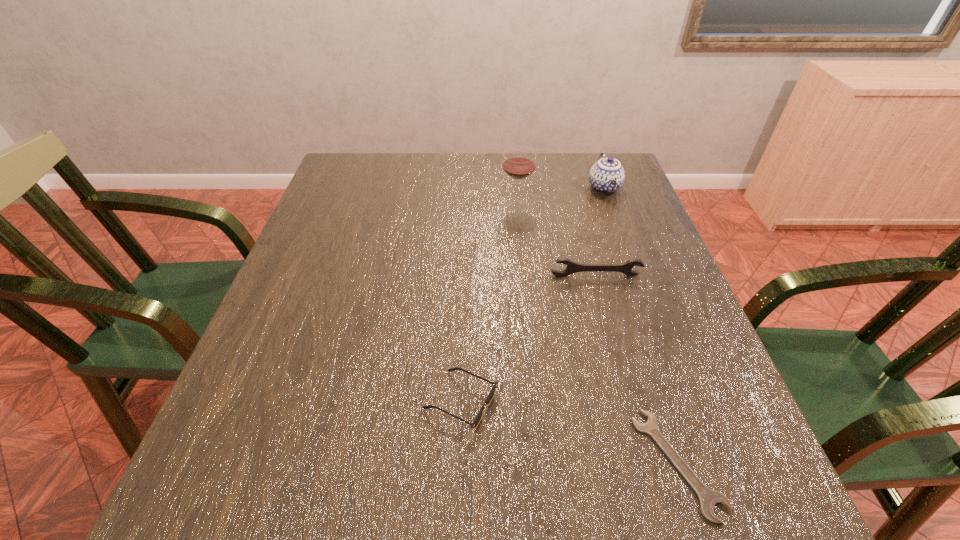
I want to click on vacant area that lies between the second shortest object and the second object from left to right, so click(x=489, y=303).

The height and width of the screenshot is (540, 960). Find the location of `free space between the leftmost object and the chinaware`. free space between the leftmost object and the chinaware is located at coordinates (533, 294).

Locate an element on the screen. Image resolution: width=960 pixels, height=540 pixels. free space between the third nearest object and the fourth shortest object is located at coordinates (600, 232).

Where is `the third closest object to the chinaware`? Image resolution: width=960 pixels, height=540 pixels. the third closest object to the chinaware is located at coordinates (476, 421).

You are a GUI agent. You are given a task and a screenshot of the screen. Output one action in this format:
    pyautogui.click(x=<x>, y=<y>)
    Task: Click on the object that is the third closest to the second tallest object
    The width and height of the screenshot is (960, 540).
    Given the screenshot: What is the action you would take?
    pyautogui.click(x=476, y=421)

Where is `free region that satisfies the following two spatial constraints: 1. on the front side of the nearer wrench; 2. on the left side of the wineglass`? This screenshot has width=960, height=540. free region that satisfies the following two spatial constraints: 1. on the front side of the nearer wrench; 2. on the left side of the wineglass is located at coordinates (542, 463).

Locate an element on the screen. This screenshot has height=540, width=960. free spot that satisfies the following two spatial constraints: 1. on the front side of the wineglass; 2. on the lenses of the leftmost object is located at coordinates (537, 401).

Locate an element on the screen. The height and width of the screenshot is (540, 960). free space that satisfies the following two spatial constraints: 1. on the lenses of the shortest object; 2. on the right side of the second shortest object is located at coordinates (459, 463).

Locate an element on the screen. free spot that satisfies the following two spatial constraints: 1. on the front side of the fourth object from right to left; 2. on the left side of the shortest object is located at coordinates (542, 463).

The width and height of the screenshot is (960, 540). I want to click on free space that satisfies the following two spatial constraints: 1. from the spout of the chinaware; 2. on the lenses of the fourth tallest object, so click(x=683, y=401).